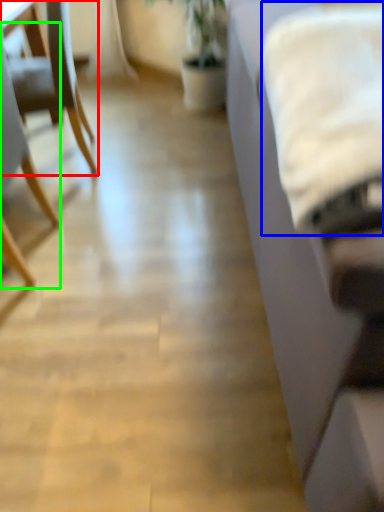
Question: Which object is the farthest from chair (highlighted by a red box)? Choose among these: sheet (highlighted by a blue box) or chair (highlighted by a green box).

Choices:
 (A) sheet
 (B) chair

Answer: (A)